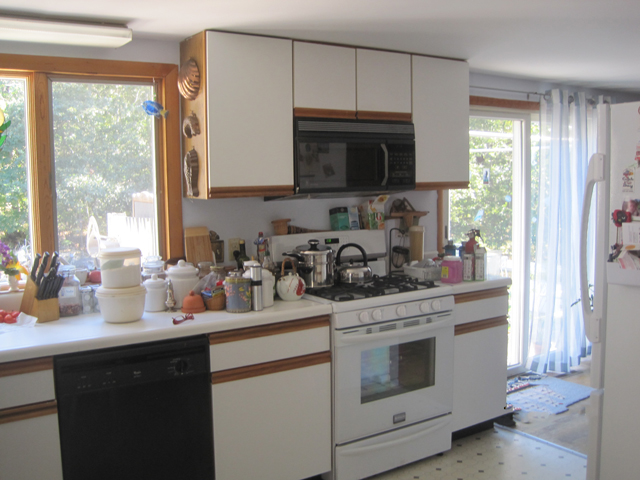
The height and width of the screenshot is (480, 640). I want to click on cabinets, so click(x=249, y=133).